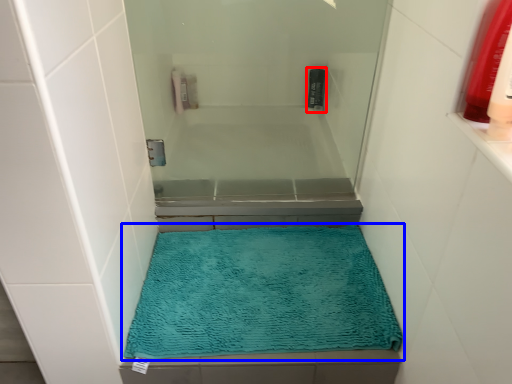
Question: Which point is further to the camera, mouthwash (highlighted by a red box) or bath mat (highlighted by a blue box)?

Choices:
 (A) mouthwash
 (B) bath mat

Answer: (A)